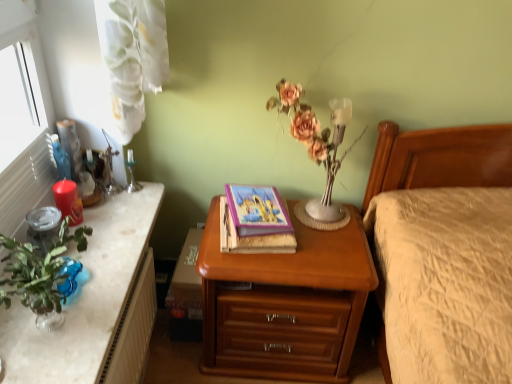
Where is `vacant space in front of matte pink flowers at center`? The image size is (512, 384). vacant space in front of matte pink flowers at center is located at coordinates (x=318, y=248).